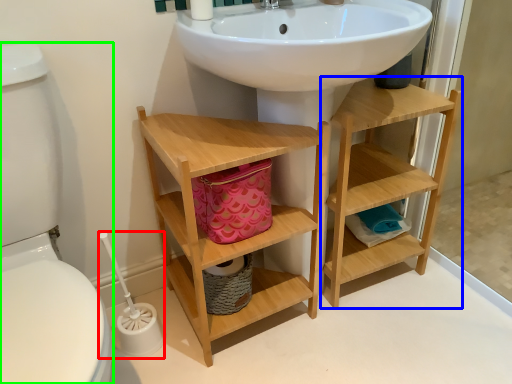
Question: Estimate the real-world distances between objects in this image. Which object is farther from brush (highlighted by a red box), shelf (highlighted by a blue box) or toilet bowl (highlighted by a green box)?

Choices:
 (A) shelf
 (B) toilet bowl

Answer: (A)